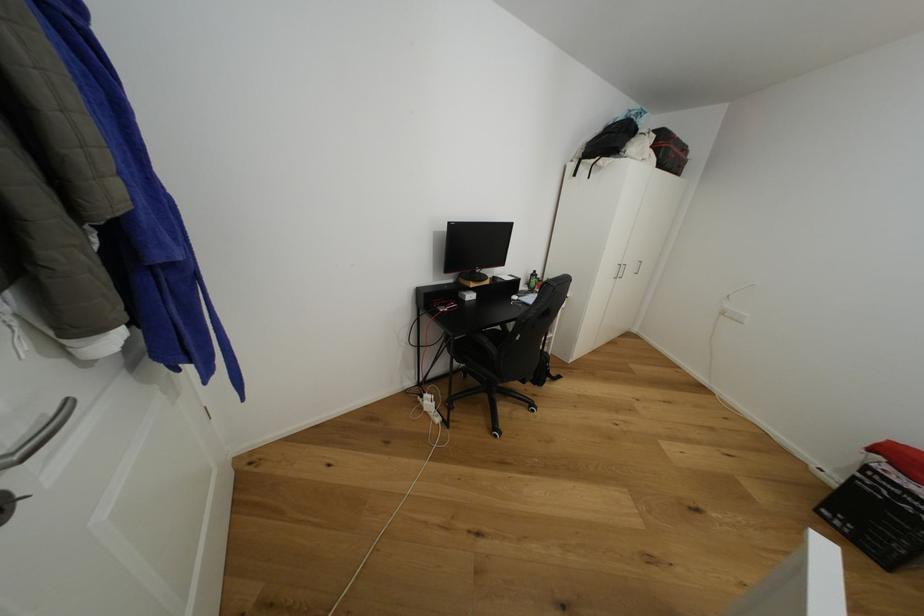
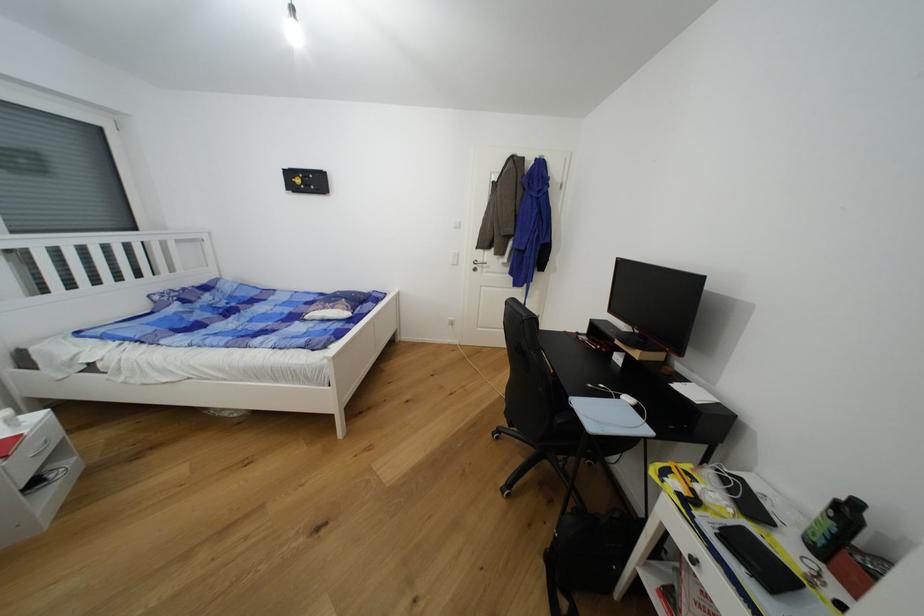
The point at (x=540, y=273) is marked in the first image. Where is the corresponding point in the second image?

(862, 506)